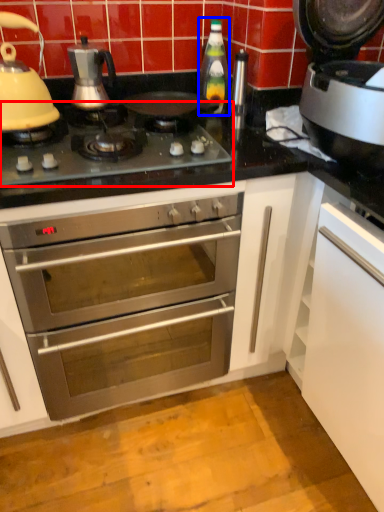
Question: Which object appears closest to the camera in this image, gas stove (highlighted by a red box) or bottle (highlighted by a blue box)?

Choices:
 (A) gas stove
 (B) bottle

Answer: (A)